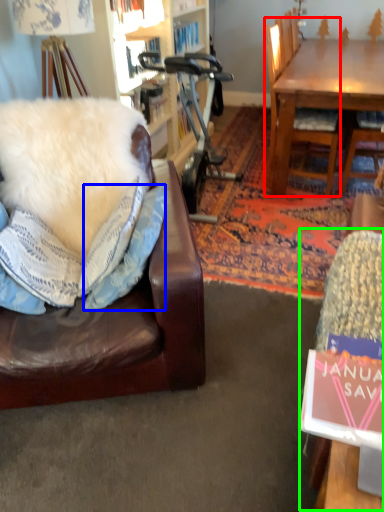
Question: Which is farther away from chair (highlighted by a red box)? pillow (highlighted by a blue box) or swivel chair (highlighted by a green box)?

Choices:
 (A) pillow
 (B) swivel chair

Answer: (B)